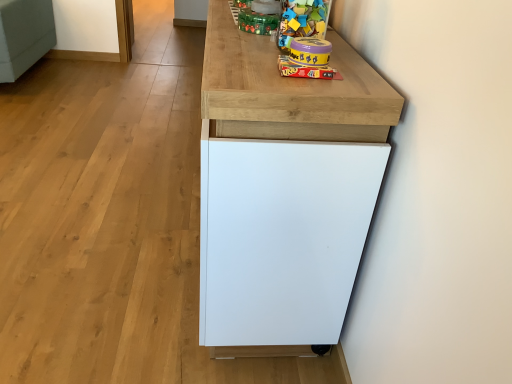
This screenshot has width=512, height=384. What do you see at coordinates (284, 190) in the screenshot?
I see `white matte cabinet at center` at bounding box center [284, 190].

This screenshot has width=512, height=384. I want to click on matte yellow plastic uno game at upper center, which appears as the 2th toy when viewed from the back, so click(308, 59).

Locate an element on the screen. The width and height of the screenshot is (512, 384). matte green plastic toy at upper center, the 1th toy when ordered from top to bottom is located at coordinates (260, 17).

Locate an element on the screen. purple plastic container at upper center, which is the 2th toy from bottom to top is located at coordinates (310, 51).

What is the approximate width of purple plastic container at upper center, which is the second toy in top-to-bottom order?

4.58 inches.

Where is `white matte cabinet at center`? The image size is (512, 384). white matte cabinet at center is located at coordinates (284, 190).

From the image's perspective, who appears lower, purple plastic container at upper center, which is the second toy in top-to-bottom order, or matte green plastic toy at upper center, the 3th toy when ordered from bottom to top?

From the image's view, purple plastic container at upper center, which is the second toy in top-to-bottom order, is below.

Could you measure the distance between purple plastic container at upper center, which is the second toy in top-to-bottom order, and matte green plastic toy at upper center, positioned as the 3th toy in front-to-back order?

They are 12.92 inches apart.

Considering the positions of point (327, 49) and point (251, 10), is point (327, 49) closer or farther from the camera than point (251, 10)?

Clearly, point (327, 49) is closer to the camera than point (251, 10).

What's the angular difference between purple plastic container at upper center, which is the 3th toy in back-to-front order, and matte green plastic toy at upper center, the 1th toy when ordered from top to bottom,'s facing directions?

There is a 1.97-degree angle between the facing directions of purple plastic container at upper center, which is the 3th toy in back-to-front order, and matte green plastic toy at upper center, the 1th toy when ordered from top to bottom.

Between point (294, 50) and point (294, 46), which one is positioned behind?

Point (294, 46)

Which of these two, matte yellow plastic uno game at upper center, which appears as the 2th toy when viewed from the back, or purple plastic container at upper center, which is the second toy in top-to-bottom order, is smaller?

Smaller between the two is matte yellow plastic uno game at upper center, which appears as the 2th toy when viewed from the back.

Would you say matte yellow plastic uno game at upper center, placed as the 1th toy when sorted from bottom to top, is a long distance from purple plastic container at upper center, arranged as the first toy when viewed from the front?

matte yellow plastic uno game at upper center, placed as the 1th toy when sorted from bottom to top, is actually quite close to purple plastic container at upper center, arranged as the first toy when viewed from the front.

Starting from the matte yellow plastic uno game at upper center, placed as the 1th toy when sorted from bottom to top, which toy is the 1st one to the left? Please provide its 2D coordinates.

[(310, 51)]

Is matte yellow plastic uno game at upper center, the third toy in the top-to-bottom sequence, completely or partially inside matte green plastic toy at upper center, arranged as the 1th toy when viewed from the back?

No, matte yellow plastic uno game at upper center, the third toy in the top-to-bottom sequence, is not inside matte green plastic toy at upper center, arranged as the 1th toy when viewed from the back.

Would you say matte green plastic toy at upper center, positioned as the 3th toy in front-to-back order, is to the left or to the right of matte yellow plastic uno game at upper center, placed as the 1th toy when sorted from bottom to top, in the picture?

Based on their positions, matte green plastic toy at upper center, positioned as the 3th toy in front-to-back order, is located to the left of matte yellow plastic uno game at upper center, placed as the 1th toy when sorted from bottom to top.

Is matte green plastic toy at upper center, arranged as the 1th toy when viewed from the back, beside matte yellow plastic uno game at upper center, which is the 2th toy in front-to-back order?

There is a gap between matte green plastic toy at upper center, arranged as the 1th toy when viewed from the back, and matte yellow plastic uno game at upper center, which is the 2th toy in front-to-back order.

Is matte green plastic toy at upper center, the 3th toy when ordered from bottom to top, positioned in front of matte yellow plastic uno game at upper center, which appears as the 2th toy when viewed from the back?

No, matte green plastic toy at upper center, the 3th toy when ordered from bottom to top, is further to the viewer.

Measure the distance from purple plastic container at upper center, which is the 2th toy from bottom to top, to matte yellow plastic uno game at upper center, which appears as the 2th toy when viewed from the back.

purple plastic container at upper center, which is the 2th toy from bottom to top, and matte yellow plastic uno game at upper center, which appears as the 2th toy when viewed from the back, are 0.35 inches apart.

Does purple plastic container at upper center, which is the 3th toy in back-to-front order, have a lesser width compared to matte yellow plastic uno game at upper center, which is the 2th toy in front-to-back order?

Yes, purple plastic container at upper center, which is the 3th toy in back-to-front order, is thinner than matte yellow plastic uno game at upper center, which is the 2th toy in front-to-back order.

Does purple plastic container at upper center, arranged as the first toy when viewed from the front, have a smaller size compared to matte yellow plastic uno game at upper center, placed as the 1th toy when sorted from bottom to top?

No.

From the image's perspective, who appears lower, purple plastic container at upper center, arranged as the first toy when viewed from the front, or matte yellow plastic uno game at upper center, which appears as the 2th toy when viewed from the back?

matte yellow plastic uno game at upper center, which appears as the 2th toy when viewed from the back.

Where is `cabinetry that appears below the purple plastic container at upper center, which is the 2th toy from bottom to top (from the image's perspective)`? This screenshot has height=384, width=512. cabinetry that appears below the purple plastic container at upper center, which is the 2th toy from bottom to top (from the image's perspective) is located at coordinates (284, 190).

Is purple plastic container at upper center, which is the second toy in top-to-bottom order, behind white matte cabinet at center?

Yes.

Which is more to the right, matte green plastic toy at upper center, the 3th toy when ordered from bottom to top, or white matte cabinet at center?

matte green plastic toy at upper center, the 3th toy when ordered from bottom to top, is more to the right.

From the image's perspective, is matte green plastic toy at upper center, arranged as the 1th toy when viewed from the back, positioned above or below white matte cabinet at center?

matte green plastic toy at upper center, arranged as the 1th toy when viewed from the back, is above white matte cabinet at center.

From the picture: Is white matte cabinet at center at the back of matte green plastic toy at upper center, arranged as the 1th toy when viewed from the back?

No.

How distant is matte green plastic toy at upper center, arranged as the 1th toy when viewed from the back, from white matte cabinet at center?

21.48 inches.

Considering the sizes of objects white matte cabinet at center and matte yellow plastic uno game at upper center, the third toy in the top-to-bottom sequence, in the image provided, who is smaller, white matte cabinet at center or matte yellow plastic uno game at upper center, the third toy in the top-to-bottom sequence,?

matte yellow plastic uno game at upper center, the third toy in the top-to-bottom sequence, is smaller.

Considering the positions of points (324, 235) and (296, 67), is point (324, 235) closer to camera compared to point (296, 67)?

No, it is behind (296, 67).

Looking at this image, considering the relative sizes of white matte cabinet at center and matte yellow plastic uno game at upper center, the third toy in the top-to-bottom sequence, in the image provided, is white matte cabinet at center shorter than matte yellow plastic uno game at upper center, the third toy in the top-to-bottom sequence,?

Incorrect, the height of white matte cabinet at center does not fall short of that of matte yellow plastic uno game at upper center, the third toy in the top-to-bottom sequence.

The image size is (512, 384). I want to click on toy above the purple plastic container at upper center, which is the 2th toy from bottom to top (from a real-world perspective), so click(x=260, y=17).

Locate an element on the screen. This screenshot has height=384, width=512. the 1st toy behind the purple plastic container at upper center, arranged as the first toy when viewed from the front is located at coordinates (308, 59).

Looking at the image, which one is located closer to matte yellow plastic uno game at upper center, which is the 2th toy in front-to-back order, purple plastic container at upper center, which is the 2th toy from bottom to top, or matte green plastic toy at upper center, the 1th toy when ordered from top to bottom?

Based on the image, purple plastic container at upper center, which is the 2th toy from bottom to top, appears to be nearer to matte yellow plastic uno game at upper center, which is the 2th toy in front-to-back order.

Which object lies nearer to the anchor point purple plastic container at upper center, which is the 3th toy in back-to-front order, matte green plastic toy at upper center, arranged as the 1th toy when viewed from the back, or matte yellow plastic uno game at upper center, the third toy in the top-to-bottom sequence?

matte yellow plastic uno game at upper center, the third toy in the top-to-bottom sequence, lies closer to purple plastic container at upper center, which is the 3th toy in back-to-front order, than the other object.

Estimate the real-world distances between objects in this image. Which object is further from matte green plastic toy at upper center, arranged as the 1th toy when viewed from the back, white matte cabinet at center or purple plastic container at upper center, which is the second toy in top-to-bottom order?

white matte cabinet at center lies further to matte green plastic toy at upper center, arranged as the 1th toy when viewed from the back, than the other object.

Looking at the image, which one is located closer to purple plastic container at upper center, arranged as the first toy when viewed from the front, white matte cabinet at center or matte yellow plastic uno game at upper center, placed as the 1th toy when sorted from bottom to top?

Among the two, matte yellow plastic uno game at upper center, placed as the 1th toy when sorted from bottom to top, is located nearer to purple plastic container at upper center, arranged as the first toy when viewed from the front.

Based on the photo, from the image, which object appears to be nearer to matte green plastic toy at upper center, arranged as the 1th toy when viewed from the back, purple plastic container at upper center, which is the second toy in top-to-bottom order, or matte yellow plastic uno game at upper center, which is the 2th toy in front-to-back order?

purple plastic container at upper center, which is the second toy in top-to-bottom order, is positioned closer to the anchor matte green plastic toy at upper center, arranged as the 1th toy when viewed from the back.

Estimate the real-world distances between objects in this image. Which object is closer to matte yellow plastic uno game at upper center, placed as the 1th toy when sorted from bottom to top, white matte cabinet at center or matte green plastic toy at upper center, arranged as the 1th toy when viewed from the back?

white matte cabinet at center is positioned closer to the anchor matte yellow plastic uno game at upper center, placed as the 1th toy when sorted from bottom to top.

Estimate the real-world distances between objects in this image. Which object is further from white matte cabinet at center, matte green plastic toy at upper center, the 3th toy when ordered from bottom to top, or matte yellow plastic uno game at upper center, which is the 2th toy in front-to-back order?

Based on the image, matte green plastic toy at upper center, the 3th toy when ordered from bottom to top, appears to be further to white matte cabinet at center.

When comparing their distances from white matte cabinet at center, does matte yellow plastic uno game at upper center, which appears as the 2th toy when viewed from the back, or matte green plastic toy at upper center, positioned as the 3th toy in front-to-back order, seem further?

Among the two, matte green plastic toy at upper center, positioned as the 3th toy in front-to-back order, is located further to white matte cabinet at center.

Locate an element on the screen. The height and width of the screenshot is (384, 512). toy between matte green plastic toy at upper center, the 3th toy when ordered from bottom to top, and matte yellow plastic uno game at upper center, placed as the 1th toy when sorted from bottom to top, vertically is located at coordinates (310, 51).